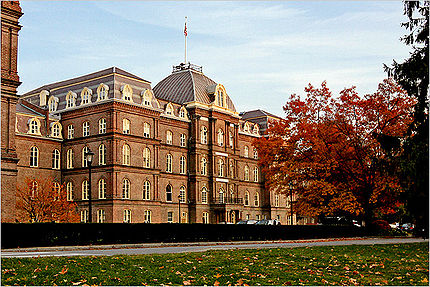
The image size is (430, 287). Find the location of `window`. window is located at coordinates (169, 166).